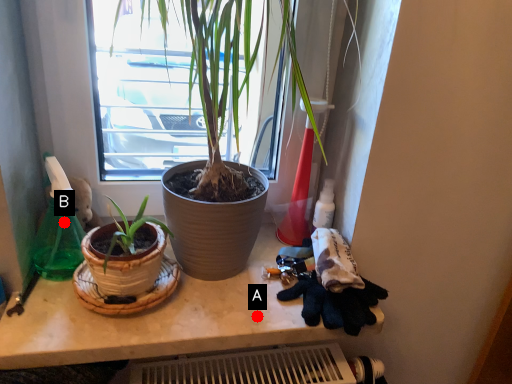
Question: Two points are circled on the image, labeled by A and B beside each circle. Which point is further to the camera?

Choices:
 (A) A is further
 (B) B is further

Answer: (B)